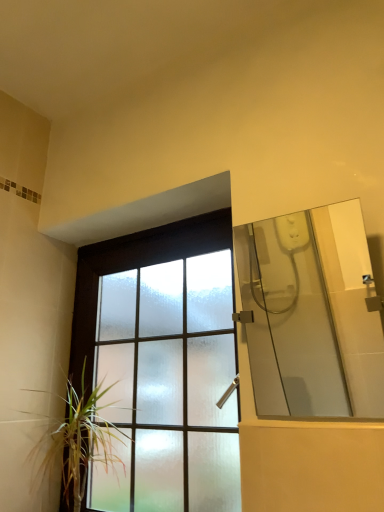
The width and height of the screenshot is (384, 512). What do you see at coordinates (79, 441) in the screenshot?
I see `green leafy plant at lower left` at bounding box center [79, 441].

This screenshot has height=512, width=384. What do you see at coordinates (312, 316) in the screenshot?
I see `transparent glass shower door at right` at bounding box center [312, 316].

In order to face frosted glass window at center, should I rotate leftwards or rightwards?

Rotate your view left by about 6.015°.

Locate an element on the screen. frosted glass window at center is located at coordinates (163, 364).

This screenshot has height=512, width=384. What are the coordinates of `green leafy plant at lower left` in the screenshot? It's located at (79, 441).

From the image's perspective, does transparent glass shower door at right appear higher than green leafy plant at lower left?

Correct, transparent glass shower door at right appears higher than green leafy plant at lower left in the image.

Considering the sizes of transparent glass shower door at right and green leafy plant at lower left in the image, is transparent glass shower door at right taller or shorter than green leafy plant at lower left?

transparent glass shower door at right is shorter than green leafy plant at lower left.

Is transparent glass shower door at right smaller than green leafy plant at lower left?

Yes.

From a real-world perspective, relative to green leafy plant at lower left, is transparent glass shower door at right vertically above or below?

transparent glass shower door at right is situated higher than green leafy plant at lower left in the real world.

Locate an element on the screen. mirror on the right of frosted glass window at center is located at coordinates (312, 316).

Does transparent glass shower door at right turn towards frosted glass window at center?

No, transparent glass shower door at right is not oriented towards frosted glass window at center.

From a real-world perspective, who is located higher, transparent glass shower door at right or frosted glass window at center?

transparent glass shower door at right, from a real-world perspective.

Which of these two, transparent glass shower door at right or frosted glass window at center, stands shorter?

transparent glass shower door at right.

The height and width of the screenshot is (512, 384). In the image, there is a transparent glass shower door at right. Identify the location of houseplant below it (from a real-world perspective). (79, 441).

From a real-world perspective, is green leafy plant at lower left on transparent glass shower door at right?

No, from a real-world perspective, green leafy plant at lower left is not over transparent glass shower door at right

Would you say green leafy plant at lower left is outside transparent glass shower door at right?

Indeed, green leafy plant at lower left is completely outside transparent glass shower door at right.

Is green leafy plant at lower left shorter than transparent glass shower door at right?

No.

Visually, is frosted glass window at center positioned to the left or to the right of green leafy plant at lower left?

Based on their positions, frosted glass window at center is located to the right of green leafy plant at lower left.

Looking at this image, how different are the orientations of frosted glass window at center and green leafy plant at lower left in degrees?

0.531 degrees.

From the image's perspective, would you say frosted glass window at center is positioned over green leafy plant at lower left?

Yes, from the image's perspective, frosted glass window at center is above green leafy plant at lower left.

The height and width of the screenshot is (512, 384). Find the location of `houseplant that is under the frosted glass window at center (from a real-world perspective)`. houseplant that is under the frosted glass window at center (from a real-world perspective) is located at coordinates (79, 441).

Can you tell me how much frosted glass window at center and transparent glass shower door at right differ in facing direction?

The angle between the facing direction of frosted glass window at center and the facing direction of transparent glass shower door at right is 0.368 degrees.

From the picture: From the image's perspective, is frosted glass window at center located above or below transparent glass shower door at right?

Clearly, from the image's perspective, frosted glass window at center is below transparent glass shower door at right.

Does frosted glass window at center contain transparent glass shower door at right?

Definitely not — transparent glass shower door at right is not inside frosted glass window at center.

Is point (161, 247) in front of point (344, 292)?

Yes.

Would you say green leafy plant at lower left is inside or outside frosted glass window at center?

green leafy plant at lower left lies within the bounds of frosted glass window at center.

Considering the relative positions of green leafy plant at lower left and frosted glass window at center in the image provided, is green leafy plant at lower left to the left of frosted glass window at center from the viewer's perspective?

Yes, green leafy plant at lower left is to the left of frosted glass window at center.

How far apart are green leafy plant at lower left and frosted glass window at center?

green leafy plant at lower left is 8.43 inches away from frosted glass window at center.

From the image's perspective, is green leafy plant at lower left above or below frosted glass window at center?

From the image's perspective, green leafy plant at lower left appears below frosted glass window at center.

Find the location of a particular element. This screenshot has width=384, height=512. houseplant that appears below the transparent glass shower door at right (from the image's perspective) is located at coordinates (79, 441).

This screenshot has height=512, width=384. Identify the location of mirror on the right of frosted glass window at center. (312, 316).

Looking at this image, which object lies further to the anchor point transparent glass shower door at right, frosted glass window at center or green leafy plant at lower left?

The object further to transparent glass shower door at right is green leafy plant at lower left.

From the image, which object appears to be nearer to green leafy plant at lower left, frosted glass window at center or transparent glass shower door at right?

frosted glass window at center.

Based on their spatial positions, is green leafy plant at lower left or frosted glass window at center further from transparent glass shower door at right?

The object further to transparent glass shower door at right is green leafy plant at lower left.

Based on their spatial positions, is transparent glass shower door at right or frosted glass window at center further from green leafy plant at lower left?

transparent glass shower door at right lies further to green leafy plant at lower left than the other object.

Looking at the image, which one is located further to frosted glass window at center, green leafy plant at lower left or transparent glass shower door at right?

transparent glass shower door at right lies further to frosted glass window at center than the other object.

From the image, which object appears to be farther from frosted glass window at center, transparent glass shower door at right or green leafy plant at lower left?

The object further to frosted glass window at center is transparent glass shower door at right.

The width and height of the screenshot is (384, 512). I want to click on window between green leafy plant at lower left and transparent glass shower door at right, so click(x=163, y=364).